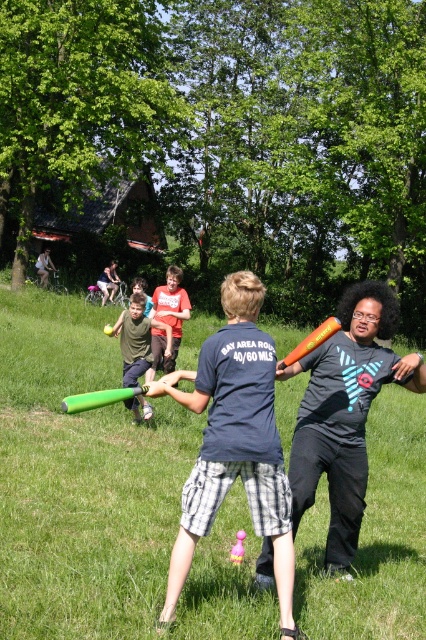
Is green foam bat at center smaller than green rubber bat at center?

No.

Is green foam bat at center to the right of green rubber bat at center from the viewer's perspective?

No, green foam bat at center is not to the right of green rubber bat at center.

Identify the location of green foam bat at center. This screenshot has height=640, width=426. (137, 339).

Does point (287, 369) lie in front of point (302, 340)?

Yes, point (287, 369) is closer to viewer.

Does matte orange bat at center appear on the right side of orange matte baseball bat at center?

In fact, matte orange bat at center is to the left of orange matte baseball bat at center.

Locate an element on the screen. matte orange bat at center is located at coordinates (345, 412).

Who is higher up, matte blue t-shirt at center or orange matte baseball bat at center?

Positioned higher is orange matte baseball bat at center.

Can you confirm if matte blue t-shirt at center is positioned to the right of orange matte baseball bat at center?

Incorrect, matte blue t-shirt at center is not on the right side of orange matte baseball bat at center.

Is point (198, 394) farther from viewer compared to point (310, 340)?

No.

This screenshot has height=640, width=426. I want to click on matte blue t-shirt at center, so click(x=235, y=442).